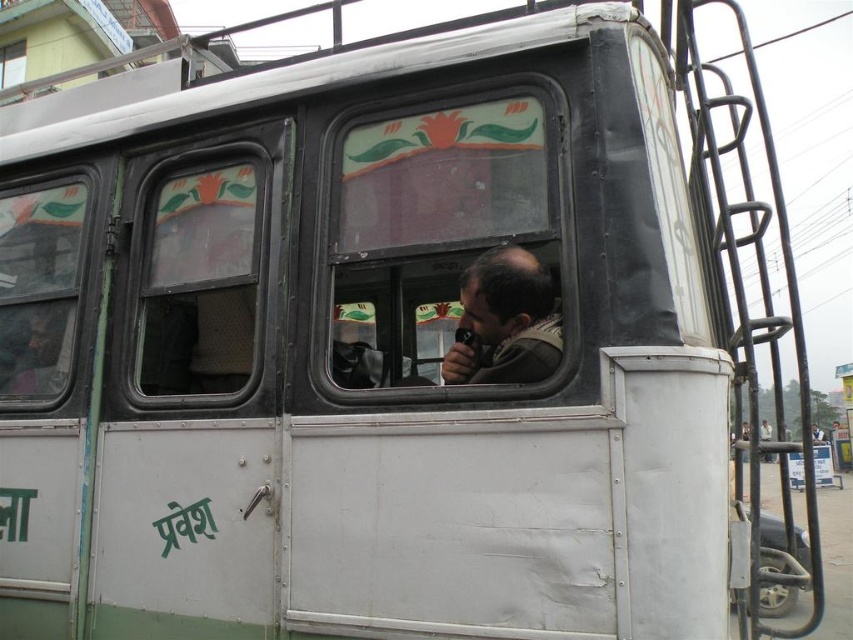
Question: From the image, what is the correct spatial relationship of transparent glass window at center in relation to clear glass window at left?

Choices:
 (A) below
 (B) above

Answer: (A)

Question: Which object appears closest to the camera in this image?

Choices:
 (A) dark brown leather jacket at center
 (B) clear glass window at left

Answer: (A)

Question: Where is clear glass window at center left located in relation to dark brown leather jacket at center in the image?

Choices:
 (A) right
 (B) left

Answer: (B)

Question: Which point is farther to the camera?

Choices:
 (A) dark brown leather jacket at center
 (B) clear glass window at left

Answer: (B)

Question: Which point is farther to the camera?

Choices:
 (A) (141, 387)
 (B) (550, 324)
 (C) (56, 323)
 (D) (555, 172)

Answer: (C)

Question: Does clear glass window at left have a greater width compared to dark brown leather jacket at center?

Choices:
 (A) yes
 (B) no

Answer: (A)